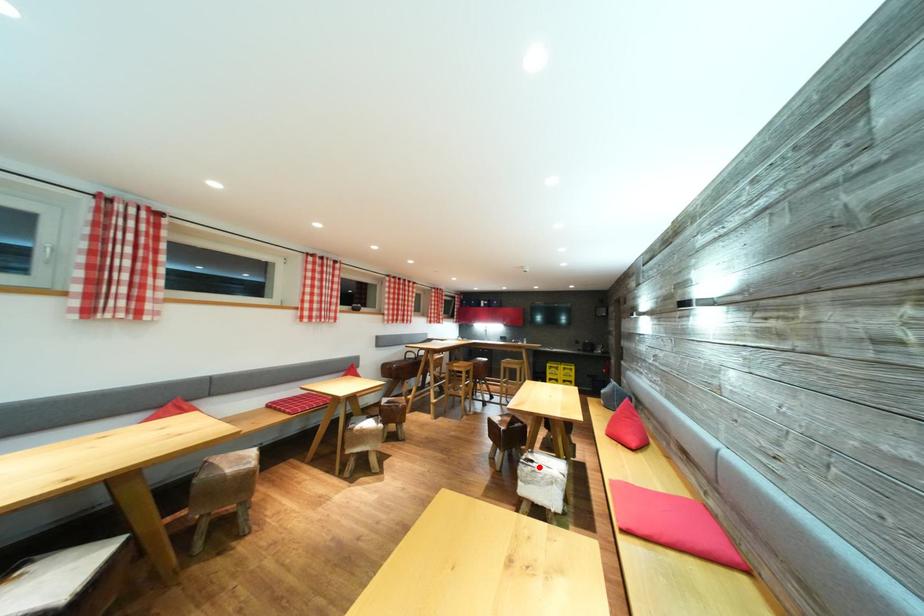
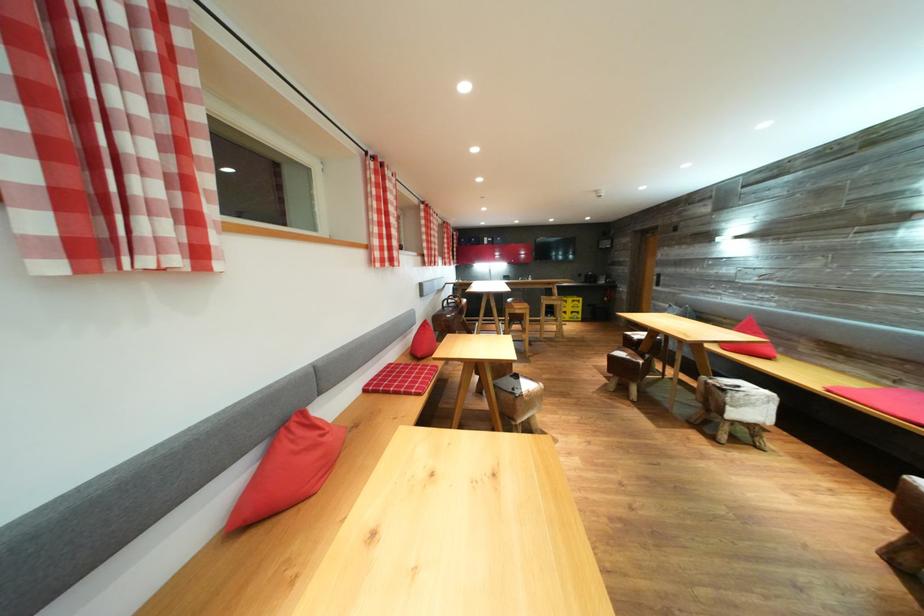
Find the pixel in the second image that matches the highlighted location in the first image.

(745, 392)